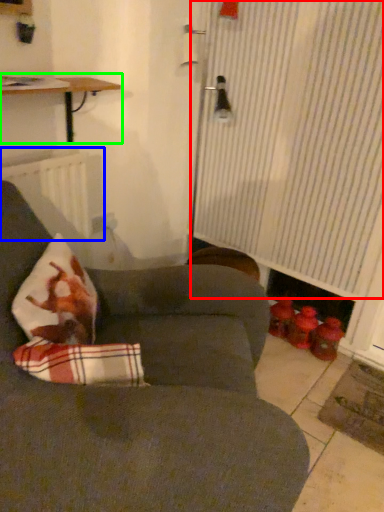
Question: Considering the real-world distances, which object is closest to curtain (highlighted by a red box)? radiator (highlighted by a blue box) or table (highlighted by a green box).

Choices:
 (A) radiator
 (B) table

Answer: (B)